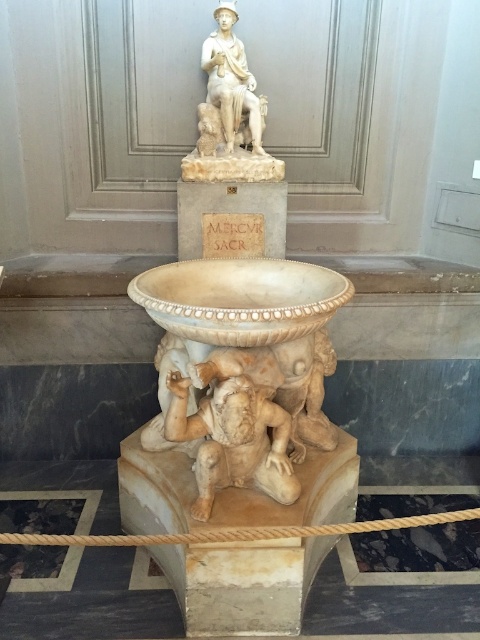
Question: Which object is farther from the camera taking this photo?

Choices:
 (A) marble statue at center
 (B) white marble statue at upper center

Answer: (B)

Question: Which point is farther to the camera?

Choices:
 (A) (228, 36)
 (B) (197, 509)

Answer: (A)

Question: Where is marble statue at center located in relation to white marble statue at upper center in the image?

Choices:
 (A) above
 (B) below

Answer: (B)

Question: Which point is farther to the camera?

Choices:
 (A) (232, 131)
 (B) (168, 378)

Answer: (A)

Question: Is marble statue at center below white marble statue at upper center?

Choices:
 (A) no
 (B) yes

Answer: (B)

Question: Does marble statue at center appear under white marble statue at upper center?

Choices:
 (A) yes
 (B) no

Answer: (A)